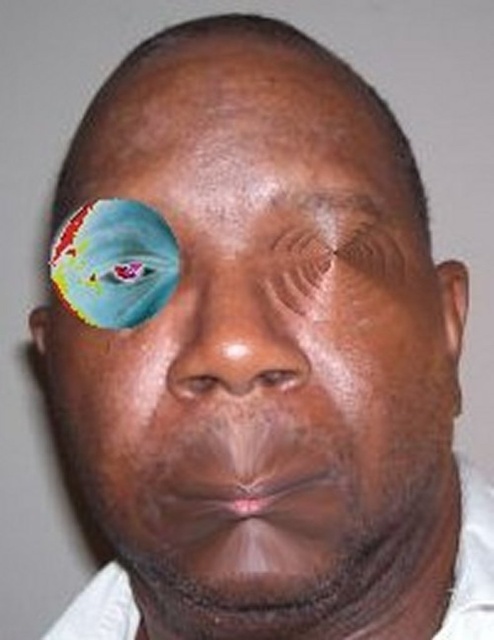
Looking at the person in the image, which facial feature is narrower between the smooth skin nose at center and the dry skin eyebrow at upper center?

The smooth skin nose at center is thinner than the dry skin eyebrow at upper center, so the smooth skin nose at center is narrower.

Looking at this image, you are standing in front of the person shown in the image. Where is the white cotton dress shirt at lower right positioned relative to the person?

The white cotton dress shirt at lower right is positioned at the coordinates point (x=472, y=563) relative to the person.